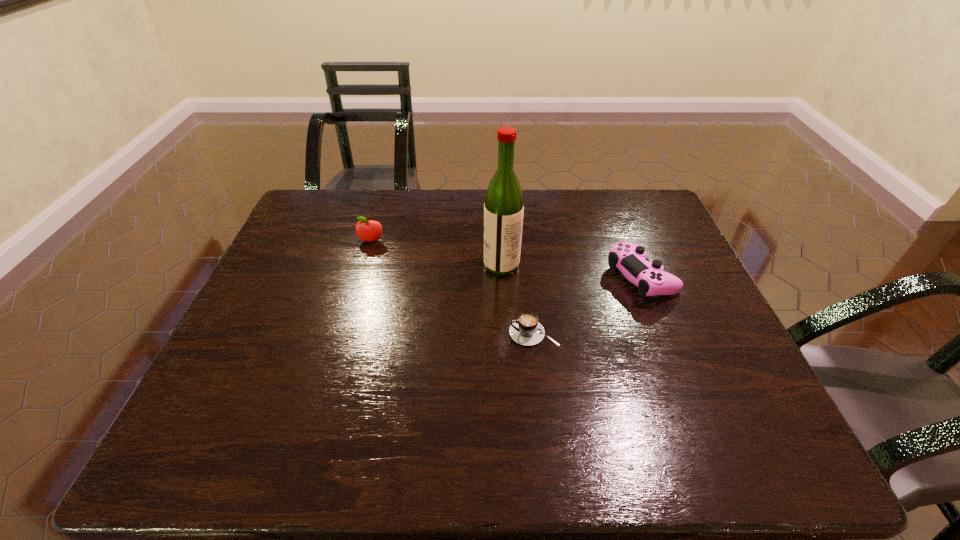
Locate an element on the screen. This screenshot has height=540, width=960. vacant space at the far right corner of the desktop is located at coordinates (656, 196).

In order to click on blank region between the liquor and the shortest object in this screenshot , I will do `click(517, 299)`.

Identify the location of vacant point located between the liquor and the cappuccino. Image resolution: width=960 pixels, height=540 pixels. (517, 299).

Locate an element on the screen. The image size is (960, 540). free space between the shortest object and the leftmost object is located at coordinates (452, 287).

This screenshot has height=540, width=960. I want to click on empty location between the leftmost object and the liquor, so click(x=436, y=253).

The height and width of the screenshot is (540, 960). I want to click on vacant area that lies between the rightmost object and the shortest object, so click(x=588, y=305).

Locate an element on the screen. The width and height of the screenshot is (960, 540). free spot between the shortest object and the farthest object is located at coordinates (452, 287).

Where is `empty space between the cappuccino and the rightmost object`? Image resolution: width=960 pixels, height=540 pixels. empty space between the cappuccino and the rightmost object is located at coordinates (588, 305).

Find the location of `empty space between the cappuccino and the rightmost object`. empty space between the cappuccino and the rightmost object is located at coordinates (588, 305).

The width and height of the screenshot is (960, 540). I want to click on free space that is in between the nearest object and the tallest object, so click(517, 299).